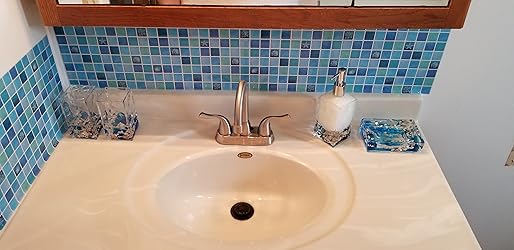
Find the location of a particular element. The image size is (514, 250). cup is located at coordinates (117, 117), (77, 110).